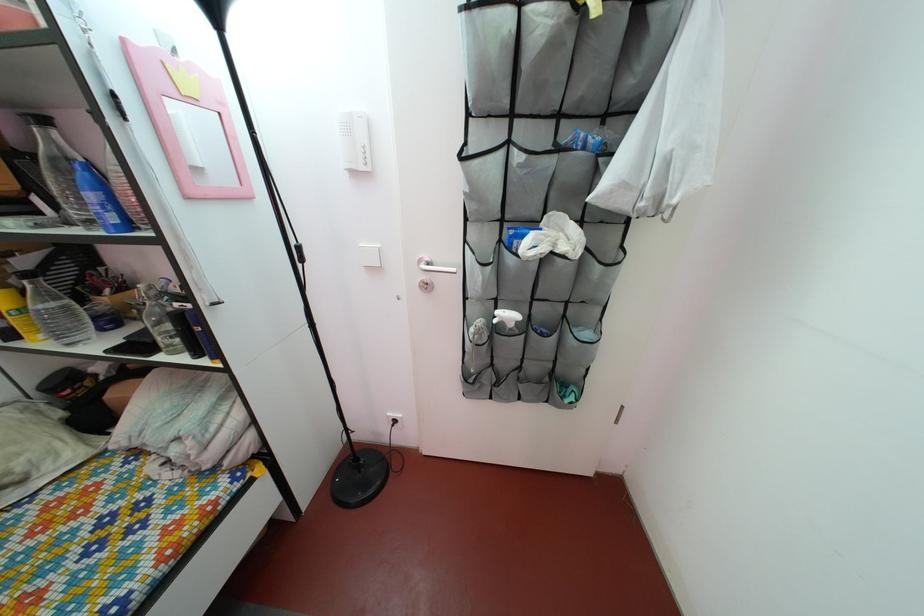
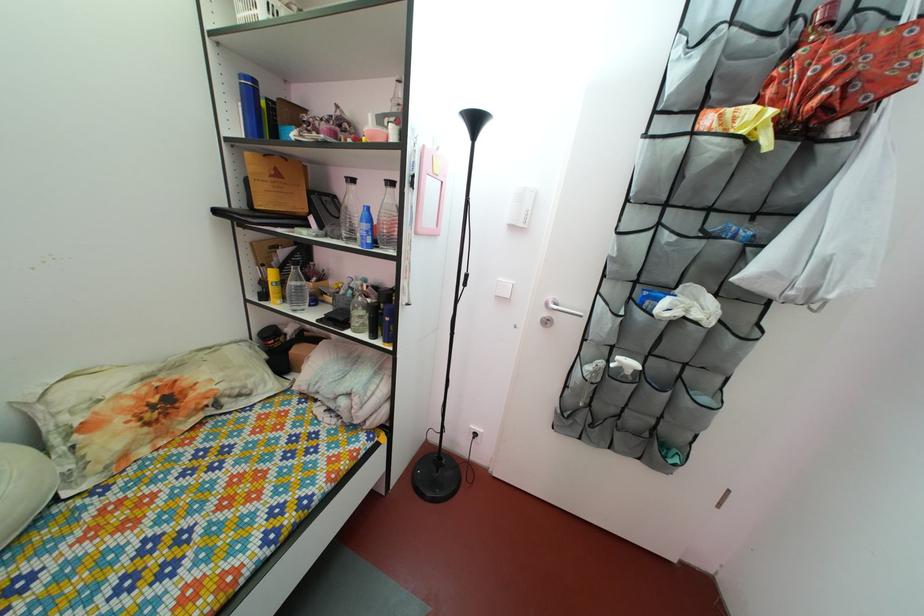
The point at [32,270] is marked in the first image. Where is the corresponding point in the second image?

(292, 262)